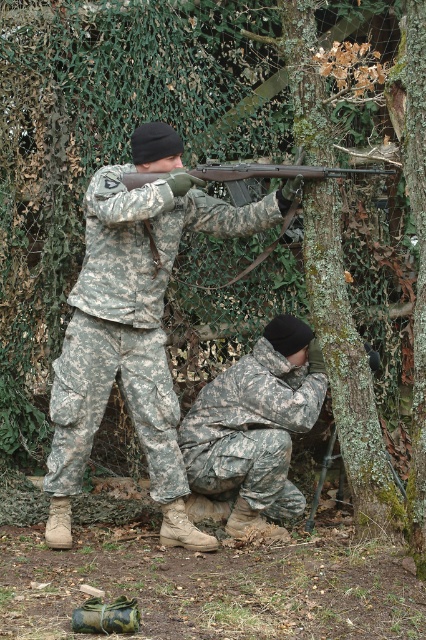
You are a military supply officer assessing the equipment in the scene. You notice the camouflage fabric uniform at lower center and the matte black shotgun at center. Which item is more compact in size?

The camouflage fabric uniform at lower center is smaller in size compared to the matte black shotgun at center, making it more compact.

Consider the image. You are a military trainee positioned at the front of the scene. You need to retrieve an object located at the camouflage fabric uniform at upper center. Considering your current position, can you reach it without moving more than 5 meters?

The camouflage fabric uniform at upper center is 4.81 meters from viewer, so yes, you can reach it without moving more than 5 meters since the distance is within the limit.